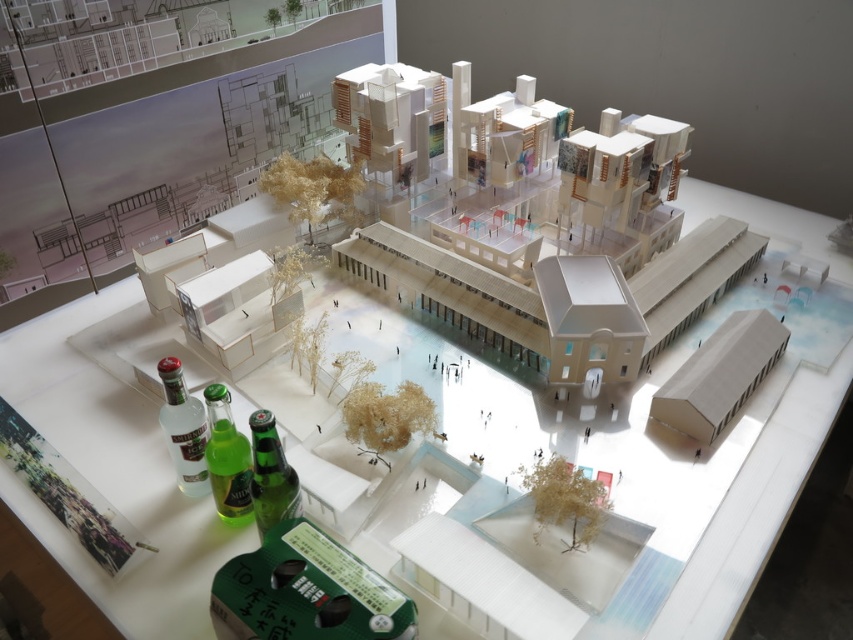
Is white cardboard table at center further to the viewer compared to green glass bottle at lower left?

No, it is not.

In order to click on white cardboard table at center in this screenshot , I will do `click(711, 497)`.

This screenshot has height=640, width=853. What do you see at coordinates (711, 497) in the screenshot?
I see `white cardboard table at center` at bounding box center [711, 497].

Where is `white cardboard table at center`? white cardboard table at center is located at coordinates (711, 497).

Between green matte beer can at center and green glass bottle at lower left, which one is positioned lower?

green matte beer can at center

Is green matte beer can at center further to camera compared to green glass bottle at lower left?

That is False.

Is point (386, 636) farther from camera compared to point (235, 516)?

No, (386, 636) is in front of (235, 516).

Locate an element on the screen. green matte beer can at center is located at coordinates (305, 592).

Which is behind, point (216, 435) or point (264, 465)?

The point (216, 435) is more distant.

From the picture: Who is more distant from viewer, (241, 440) or (271, 476)?

The point (241, 440) is more distant.

Where is `green glass bottle at lower left`? The width and height of the screenshot is (853, 640). green glass bottle at lower left is located at coordinates (227, 458).